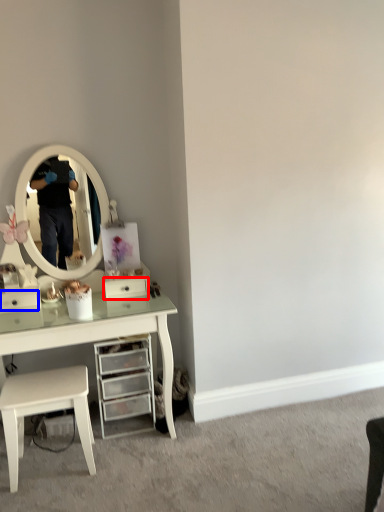
Question: Which of the following is the farthest to the observer, drawer (highlighted by a red box) or drawer (highlighted by a blue box)?

Choices:
 (A) drawer
 (B) drawer

Answer: (A)